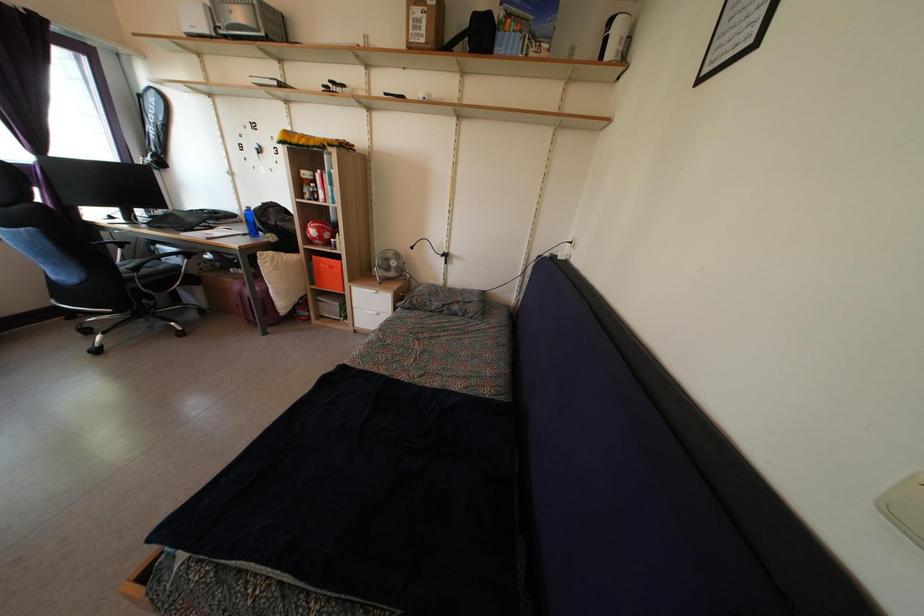
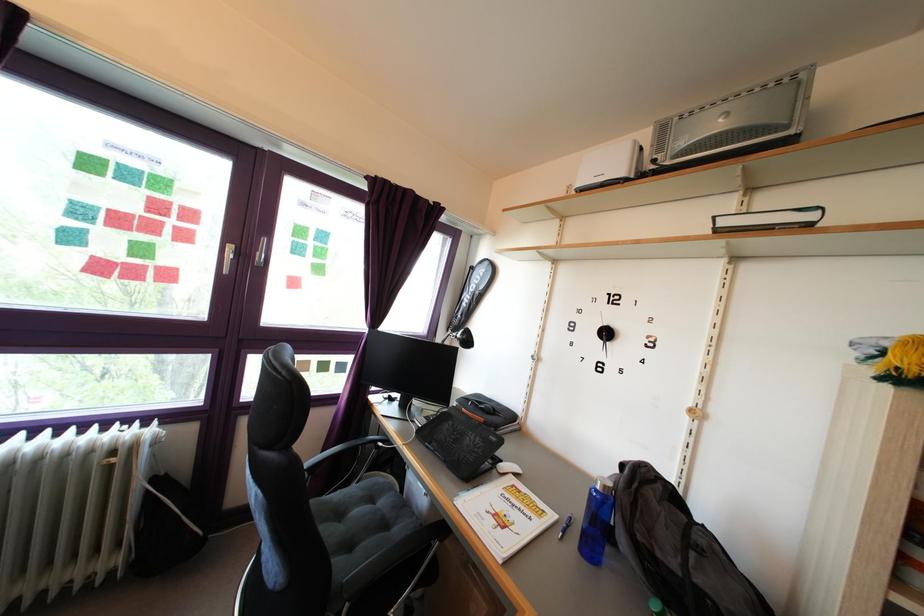
In the second image, find the point that corresponds to the point at 193,229 in the first image.

(472, 447)